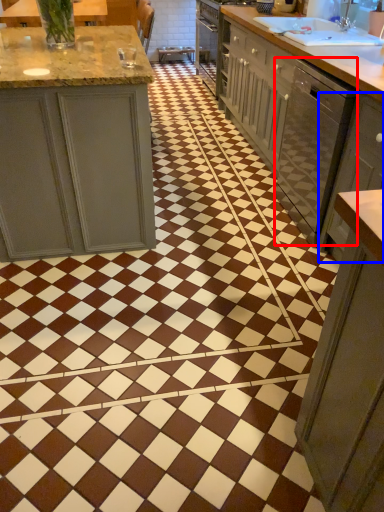
Question: Which object is closer to the camera taking this photo, dish washer (highlighted by a red box) or cabinetry (highlighted by a blue box)?

Choices:
 (A) dish washer
 (B) cabinetry

Answer: (B)